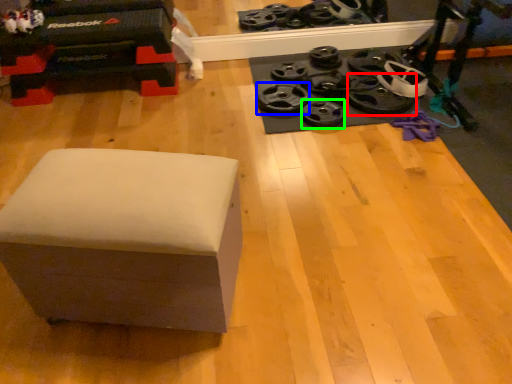
Question: Which object is the closest to the wheel (highlighted by a red box)? Choose among these: wheel (highlighted by a blue box) or wheel (highlighted by a green box).

Choices:
 (A) wheel
 (B) wheel

Answer: (B)